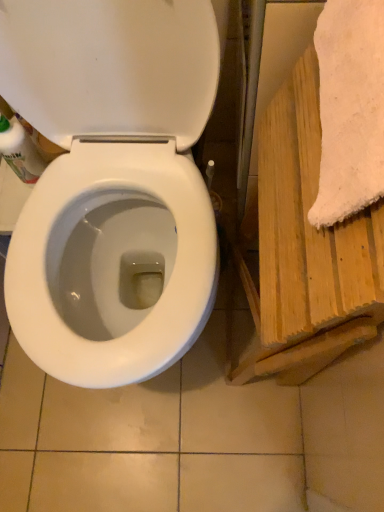
Question: Would you say translucent plastic bottle at left is part of white glossy toilet at center's contents?

Choices:
 (A) yes
 (B) no

Answer: (B)

Question: Is white glossy toilet at center not within translucent plastic bottle at left?

Choices:
 (A) yes
 (B) no

Answer: (A)

Question: Is white glossy toilet at center at the right side of translucent plastic bottle at left?

Choices:
 (A) yes
 (B) no

Answer: (A)

Question: From a real-world perspective, is white glossy toilet at center on top of translucent plastic bottle at left?

Choices:
 (A) yes
 (B) no

Answer: (A)

Question: Is white glossy toilet at center taller than translucent plastic bottle at left?

Choices:
 (A) no
 (B) yes

Answer: (B)

Question: Is wooden towel at right to the left or to the right of white glossy toilet at center in the image?

Choices:
 (A) left
 (B) right

Answer: (B)

Question: From a real-world perspective, relative to white glossy toilet at center, is wooden towel at right vertically above or below?

Choices:
 (A) below
 (B) above

Answer: (A)

Question: Is wooden towel at right in front of or behind white glossy toilet at center in the image?

Choices:
 (A) front
 (B) behind

Answer: (B)

Question: Choose the correct answer: Is wooden towel at right inside white glossy toilet at center or outside it?

Choices:
 (A) inside
 (B) outside

Answer: (B)

Question: From a real-world perspective, is translucent plastic bottle at left above or below white glossy toilet at center?

Choices:
 (A) below
 (B) above

Answer: (A)

Question: Do you think translucent plastic bottle at left is within white glossy toilet at center, or outside of it?

Choices:
 (A) inside
 (B) outside

Answer: (B)

Question: In the image, is translucent plastic bottle at left on the left side or the right side of white glossy toilet at center?

Choices:
 (A) right
 (B) left

Answer: (B)

Question: Looking at the image, does translucent plastic bottle at left seem bigger or smaller compared to white glossy toilet at center?

Choices:
 (A) small
 (B) big

Answer: (A)

Question: Is point (344, 162) positioned closer to the camera than point (36, 150)?

Choices:
 (A) closer
 (B) farther

Answer: (A)

Question: Based on their positions, is white fluffy towel at right located to the left or right of translucent plastic bottle at left?

Choices:
 (A) right
 (B) left

Answer: (A)